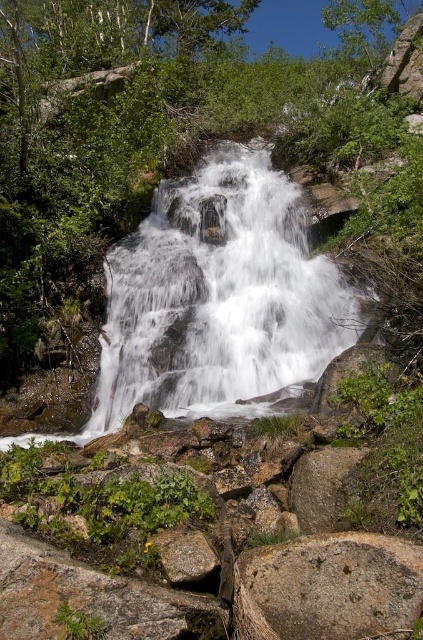
Which is in front, point (170, 292) or point (307, 538)?

Positioned in front is point (307, 538).

Is point (148, 294) closer to viewer compared to point (274, 548)?

No, it is behind (274, 548).

Find the location of a particular element. The height and width of the screenshot is (640, 423). white frothy water at center is located at coordinates (219, 298).

Who is higher up, gray rough rock at lower right or gray rough rock at lower center?

gray rough rock at lower center is higher up.

Is gray rough rock at lower right to the left of gray rough rock at lower center from the viewer's perspective?

No, gray rough rock at lower right is not to the left of gray rough rock at lower center.

The width and height of the screenshot is (423, 640). In order to click on gray rough rock at lower right in this screenshot , I will do `click(327, 588)`.

Consider the image. Does white frothy water at center appear over gray rough rock at lower center?

Indeed, white frothy water at center is positioned over gray rough rock at lower center.

Between white frothy water at center and gray rough rock at lower center, which one is positioned higher?

white frothy water at center is above.

What are the coordinates of `white frothy water at center` in the screenshot? It's located at (219, 298).